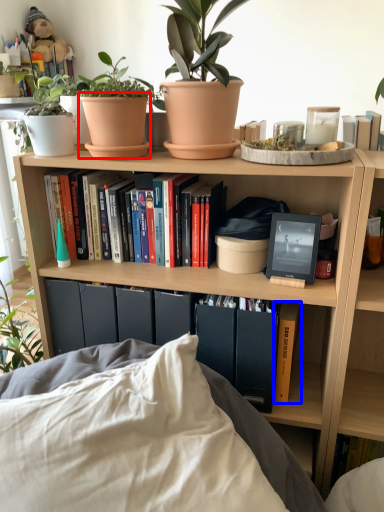
Question: Among these objects, which one is nearest to the camera, flowerpot (highlighted by a red box) or book (highlighted by a blue box)?

Choices:
 (A) flowerpot
 (B) book

Answer: (A)